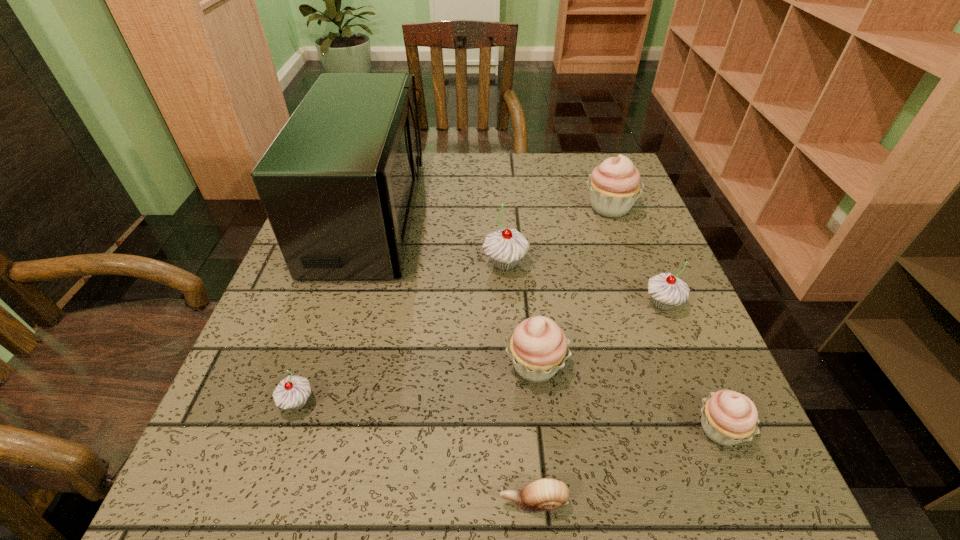
The height and width of the screenshot is (540, 960). I want to click on the leftmost cupcake, so click(x=292, y=392).

Find the location of a particular element. the leftmost gray cupcake is located at coordinates (292, 392).

Where is `the smallest pink cupcake`? the smallest pink cupcake is located at coordinates (728, 417).

Identify the location of the shortest object. (545, 494).

Identify the location of escargot. The width and height of the screenshot is (960, 540). (545, 494).

Image resolution: width=960 pixels, height=540 pixels. Identify the location of vacant space located 0.180m on the front-facing side of the microwave_oven. (491, 215).

The image size is (960, 540). Identify the location of blank space located on the front of the biggest pink cupcake. (656, 335).

I want to click on free spot located 0.380m on the back of the farthest gray cupcake, so click(x=499, y=164).

Locate an element on the screen. The width and height of the screenshot is (960, 540). vacant area situated 0.370m on the left of the second smallest gray cupcake is located at coordinates (457, 304).

The height and width of the screenshot is (540, 960). In order to click on blank space located on the back of the leftmost pink cupcake in this screenshot , I will do `click(528, 294)`.